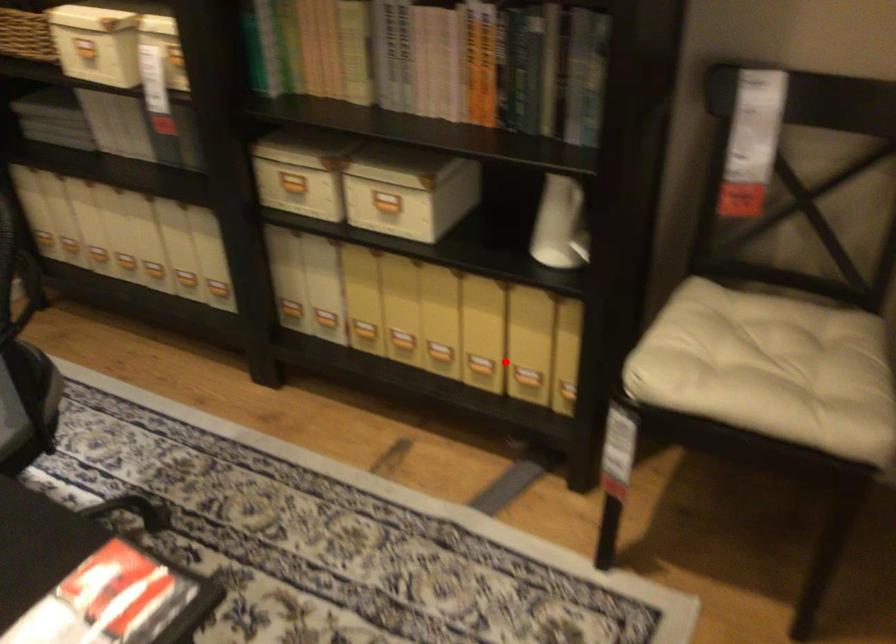
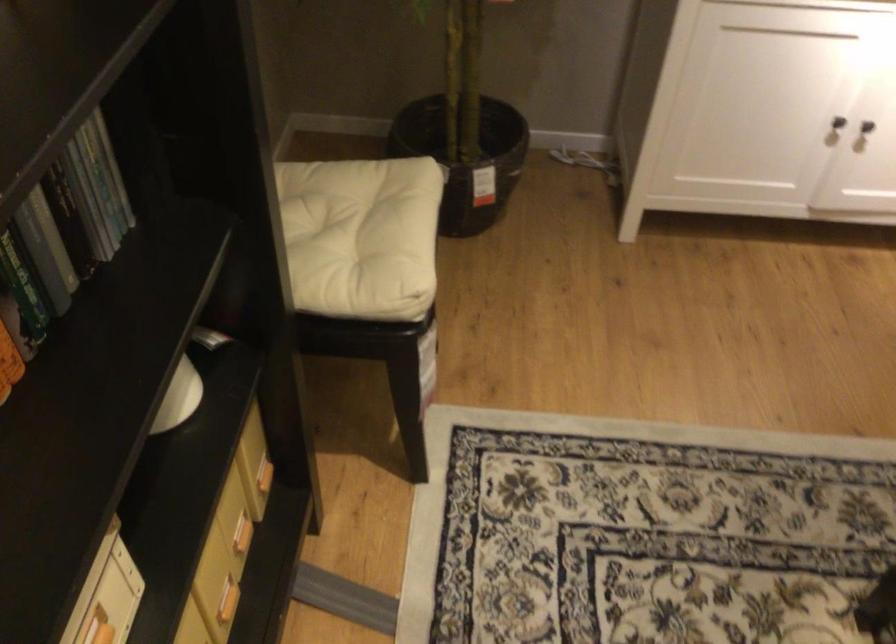
Locate, in the second image, the point that corresponds to the highlighted location in the first image.

(227, 601)